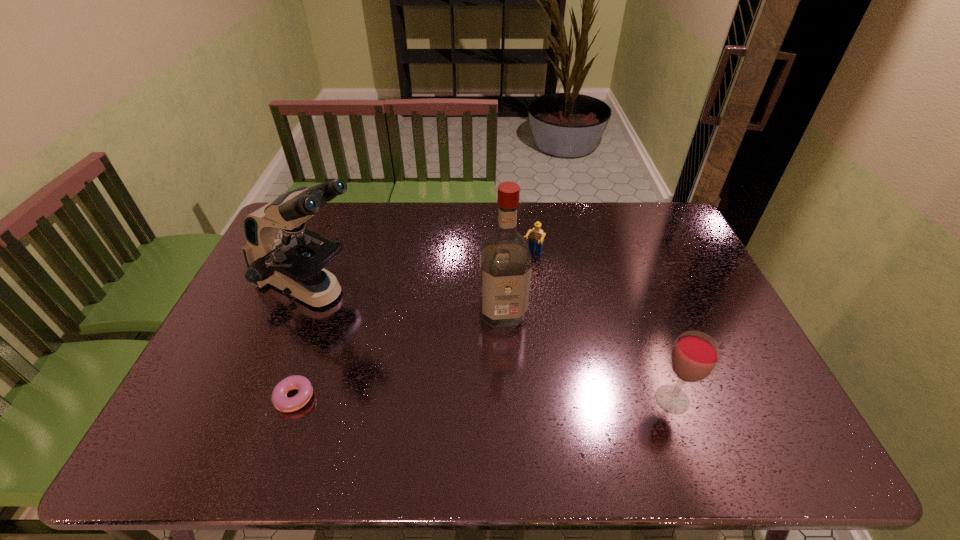
The image size is (960, 540). In order to click on doughnut in this screenshot , I will do `click(281, 402)`.

Locate an element on the screen. The height and width of the screenshot is (540, 960). the rightmost object is located at coordinates (695, 355).

Locate an element on the screen. The height and width of the screenshot is (540, 960). the third shortest object is located at coordinates (695, 355).

The image size is (960, 540). I want to click on the fourth object from left to right, so click(536, 238).

Identify the location of the fourth tallest object. The height and width of the screenshot is (540, 960). (536, 238).

Locate an element on the screen. liquor is located at coordinates (505, 260).

In order to click on microscope in this screenshot , I will do `click(280, 251)`.

Image resolution: width=960 pixels, height=540 pixels. I want to click on vacant space located 0.150m on the back of the doughnut, so click(317, 335).

Image resolution: width=960 pixels, height=540 pixels. What are the coordinates of `free space located on the right of the wineglass` in the screenshot? It's located at (765, 399).

I want to click on free space located 0.180m on the face of the Lego, so click(510, 298).